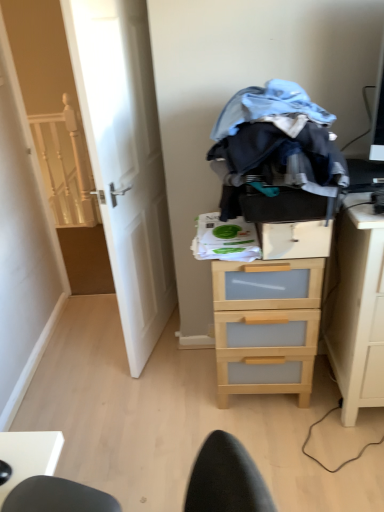
The width and height of the screenshot is (384, 512). What are the coordinates of `vacant point to the left of white wooden door at left` in the screenshot? It's located at (75, 348).